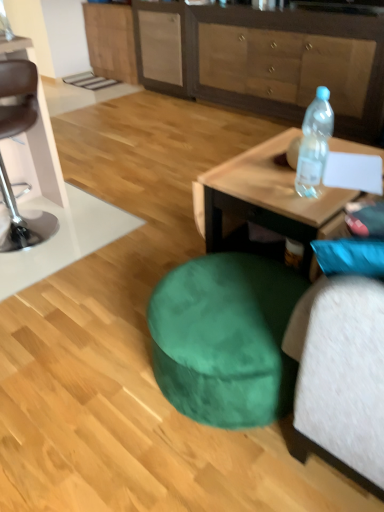
What is the approximate width of transparent plastic bottle at upper right?

The width of transparent plastic bottle at upper right is 11.24 centimeters.

I want to click on brown leather bar stool at left, so click(18, 95).

Describe the element at coordinates (210, 422) in the screenshot. I see `velvet green bean bag at lower center` at that location.

What do you see at coordinates (111, 41) in the screenshot?
I see `matte wood cabinet at upper center, acting as the first cabinetry starting from the back` at bounding box center [111, 41].

You are a GUI agent. You are given a task and a screenshot of the screen. Output one action in this format:
    pyautogui.click(x=<x>, y=<y>)
    Task: Click on the transparent plastic bottle at upper right
    The width and height of the screenshot is (384, 512).
    Given the screenshot: What is the action you would take?
    pyautogui.click(x=314, y=144)

How far apart are velvet green bean bag at lower center and brown leather bar stool at left?

velvet green bean bag at lower center is 1.41 meters from brown leather bar stool at left.

This screenshot has width=384, height=512. What are the coordinates of `chair located above the velvet green bean bag at lower center (from a real-world perspective)` in the screenshot? It's located at (18, 95).

Who is shorter, velvet green bean bag at lower center or brown leather bar stool at left?

velvet green bean bag at lower center.

In terms of size, does velvet green bean bag at lower center appear bigger or smaller than brown leather bar stool at left?

Considering their sizes, velvet green bean bag at lower center takes up less space than brown leather bar stool at left.

Find the location of `bottle below the wooden cabinet at upper center, which ranks as the second cabinetry in back-to-front order (from the image's perspective)`. bottle below the wooden cabinet at upper center, which ranks as the second cabinetry in back-to-front order (from the image's perspective) is located at coordinates (314, 144).

Is transparent plastic bottle at upper right positioned with its back to wooden cabinet at upper center, which appears as the 2th cabinetry when viewed from the left?

No, transparent plastic bottle at upper right's orientation is not away from wooden cabinet at upper center, which appears as the 2th cabinetry when viewed from the left.

Which object is thinner, transparent plastic bottle at upper right or wooden cabinet at upper center, marked as the first cabinetry in a front-to-back arrangement?

transparent plastic bottle at upper right.

Which object is positioned more to the right, transparent plastic bottle at upper right or wooden cabinet at upper center, which ranks as the second cabinetry in back-to-front order?

wooden cabinet at upper center, which ranks as the second cabinetry in back-to-front order, is more to the right.

Measure the distance between matte wood cabinet at upper center, acting as the first cabinetry starting from the back, and transparent plastic bottle at upper right.

matte wood cabinet at upper center, acting as the first cabinetry starting from the back, and transparent plastic bottle at upper right are 3.75 meters apart.

Is matte wood cabinet at upper center, positioned as the 2th cabinetry in right-to-left order, beside transparent plastic bottle at upper right?

They are not placed beside each other.

Considering the sizes of objects matte wood cabinet at upper center, which appears as the 2th cabinetry when viewed from the front, and transparent plastic bottle at upper right in the image provided, who is bigger, matte wood cabinet at upper center, which appears as the 2th cabinetry when viewed from the front, or transparent plastic bottle at upper right?

matte wood cabinet at upper center, which appears as the 2th cabinetry when viewed from the front, is bigger.

Which is more to the left, matte wood cabinet at upper center, placed as the first cabinetry when sorted from left to right, or transparent plastic bottle at upper right?

From the viewer's perspective, matte wood cabinet at upper center, placed as the first cabinetry when sorted from left to right, appears more on the left side.

From the image's perspective, which is above, wooden coffee table at right or matte wood cabinet at upper center, acting as the first cabinetry starting from the back?

matte wood cabinet at upper center, acting as the first cabinetry starting from the back, is shown above in the image.

Identify the location of cabinetry that is the 2nd one when counting backward from the wooden coffee table at right. (111, 41).

Relative to matte wood cabinet at upper center, acting as the first cabinetry starting from the back, is wooden coffee table at right in front or behind?

Clearly, wooden coffee table at right is in front of matte wood cabinet at upper center, acting as the first cabinetry starting from the back.

Between wooden coffee table at right and matte wood cabinet at upper center, which appears as the 2th cabinetry when viewed from the front, which one appears on the left side from the viewer's perspective?

matte wood cabinet at upper center, which appears as the 2th cabinetry when viewed from the front, is more to the left.

Considering the relative sizes of transparent plastic bottle at upper right and velvet green bean bag at lower center in the image provided, is transparent plastic bottle at upper right wider than velvet green bean bag at lower center?

Incorrect, the width of transparent plastic bottle at upper right does not surpass that of velvet green bean bag at lower center.

Is there a large distance between transparent plastic bottle at upper right and velvet green bean bag at lower center?

No, transparent plastic bottle at upper right is not far from velvet green bean bag at lower center.

From the image's perspective, is transparent plastic bottle at upper right above velvet green bean bag at lower center?

Yes, from the image's perspective, transparent plastic bottle at upper right is above velvet green bean bag at lower center.

From their relative heights in the image, would you say transparent plastic bottle at upper right is taller or shorter than velvet green bean bag at lower center?

In the image, transparent plastic bottle at upper right appears to be taller than velvet green bean bag at lower center.

How many degrees apart are the facing directions of wooden cabinet at upper center, which appears as the 2th cabinetry when viewed from the left, and transparent plastic bottle at upper right?

wooden cabinet at upper center, which appears as the 2th cabinetry when viewed from the left, and transparent plastic bottle at upper right are facing 88.7 degrees away from each other.

From the image's perspective, is wooden cabinet at upper center, which appears as the 2th cabinetry when viewed from the left, above or below transparent plastic bottle at upper right?

Based on their image positions, wooden cabinet at upper center, which appears as the 2th cabinetry when viewed from the left, is located above transparent plastic bottle at upper right.

Can you confirm if wooden cabinet at upper center, marked as the first cabinetry in a front-to-back arrangement, is positioned to the left of transparent plastic bottle at upper right?

In fact, wooden cabinet at upper center, marked as the first cabinetry in a front-to-back arrangement, is to the right of transparent plastic bottle at upper right.

Could you tell me if wooden cabinet at upper center, which ranks as the second cabinetry in back-to-front order, is turned towards wooden coffee table at right?

Yes, wooden cabinet at upper center, which ranks as the second cabinetry in back-to-front order, is turned towards wooden coffee table at right.

Between wooden cabinet at upper center, which is the 1th cabinetry in right-to-left order, and wooden coffee table at right, which one has more height?

With more height is wooden cabinet at upper center, which is the 1th cabinetry in right-to-left order.

Is wooden cabinet at upper center, which is the 1th cabinetry in right-to-left order, not within wooden coffee table at right?

Yes, wooden cabinet at upper center, which is the 1th cabinetry in right-to-left order, is outside of wooden coffee table at right.

Between wooden cabinet at upper center, which is the 1th cabinetry in right-to-left order, and wooden coffee table at right, which one appears on the right side from the viewer's perspective?

Positioned to the right is wooden cabinet at upper center, which is the 1th cabinetry in right-to-left order.

You are a GUI agent. You are given a task and a screenshot of the screen. Output one action in this format:
    pyautogui.click(x=<x>, y=<y>)
    Task: Click on the bean bag chair in front of the brown leather bar stool at left
    Image resolution: width=384 pixels, height=512 pixels.
    Given the screenshot: What is the action you would take?
    pyautogui.click(x=210, y=422)

Locate an element on the screen. cabinetry that is the 1st object located behind the transparent plastic bottle at upper right is located at coordinates (284, 63).

From the image, which object appears to be farther from brown leather bar stool at left, transparent plastic bottle at upper right or matte wood cabinet at upper center, placed as the first cabinetry when sorted from left to right?

matte wood cabinet at upper center, placed as the first cabinetry when sorted from left to right, is further to brown leather bar stool at left.

From the image, which object appears to be farther from wooden cabinet at upper center, which ranks as the second cabinetry in back-to-front order, wooden coffee table at right or transparent plastic bottle at upper right?

transparent plastic bottle at upper right is further to wooden cabinet at upper center, which ranks as the second cabinetry in back-to-front order.

When comparing their distances from matte wood cabinet at upper center, which appears as the 2th cabinetry when viewed from the front, does brown leather bar stool at left or wooden cabinet at upper center, which is the 1th cabinetry in right-to-left order, seem further?

brown leather bar stool at left.

Based on the photo, when comparing their distances from velvet green bean bag at lower center, does wooden coffee table at right or matte wood cabinet at upper center, acting as the first cabinetry starting from the back, seem further?

matte wood cabinet at upper center, acting as the first cabinetry starting from the back, lies further to velvet green bean bag at lower center than the other object.

Based on the photo, looking at the image, which one is located closer to wooden coffee table at right, brown leather bar stool at left or velvet green bean bag at lower center?

velvet green bean bag at lower center is closer to wooden coffee table at right.

From the image, which object appears to be nearer to transparent plastic bottle at upper right, brown leather bar stool at left or wooden coffee table at right?

Among the two, wooden coffee table at right is located nearer to transparent plastic bottle at upper right.

Considering their positions, is matte wood cabinet at upper center, placed as the first cabinetry when sorted from left to right, positioned further to velvet green bean bag at lower center than wooden coffee table at right?

Based on the image, matte wood cabinet at upper center, placed as the first cabinetry when sorted from left to right, appears to be further to velvet green bean bag at lower center.

When comparing their distances from brown leather bar stool at left, does transparent plastic bottle at upper right or wooden cabinet at upper center, which appears as the 2th cabinetry when viewed from the left, seem closer?

transparent plastic bottle at upper right lies closer to brown leather bar stool at left than the other object.

Where is `bean bag chair located between brown leather bar stool at left and transparent plastic bottle at upper right in the left-right direction`? The width and height of the screenshot is (384, 512). bean bag chair located between brown leather bar stool at left and transparent plastic bottle at upper right in the left-right direction is located at coordinates (210, 422).

Locate an element on the screen. The width and height of the screenshot is (384, 512). coffee table between brown leather bar stool at left and wooden cabinet at upper center, marked as the first cabinetry in a front-to-back arrangement is located at coordinates (265, 198).

Identify the location of coffee table between transparent plastic bottle at upper right and matte wood cabinet at upper center, positioned as the 2th cabinetry in right-to-left order, along the z-axis. Image resolution: width=384 pixels, height=512 pixels. (265, 198).

The width and height of the screenshot is (384, 512). In order to click on bottle between wooden cabinet at upper center, which is the 1th cabinetry in right-to-left order, and wooden coffee table at right, in the vertical direction in this screenshot , I will do `click(314, 144)`.